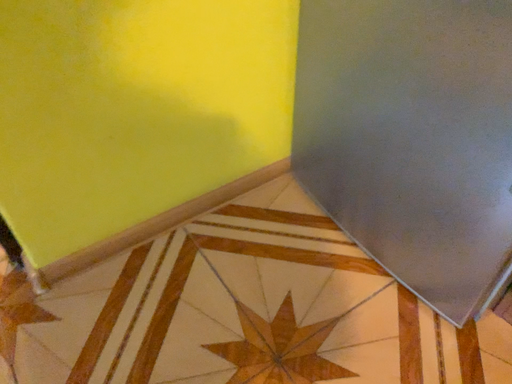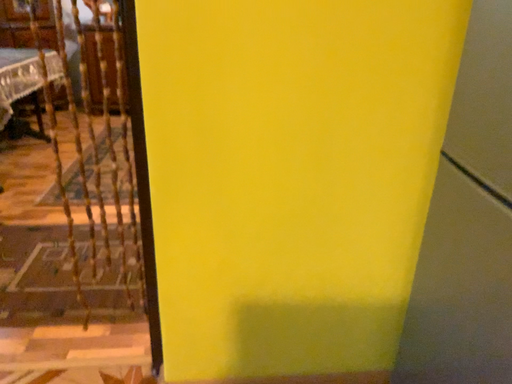
Question: How did the camera likely rotate when shooting the video?

Choices:
 (A) rotated upward
 (B) rotated downward

Answer: (A)